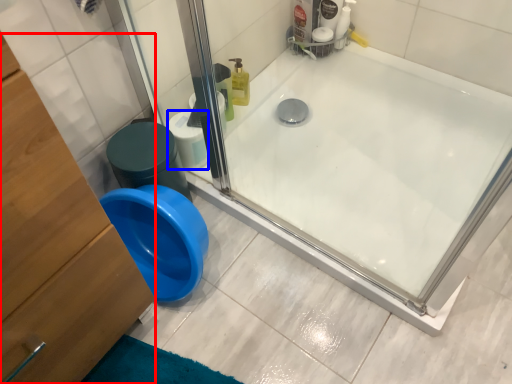
Question: Which point is closer to the camera, dresser (highlighted by a red box) or toilet paper (highlighted by a blue box)?

Choices:
 (A) dresser
 (B) toilet paper

Answer: (A)